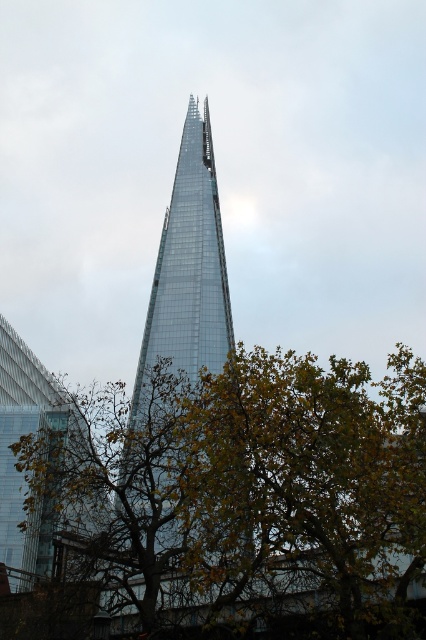
You are standing in a park and see the green leafy tree at center and the transparent glass tower at left. Which object is closer to your left side?

The transparent glass tower at left is closer to your left side because it is positioned to the left of the green leafy tree at center.

Based on the photo, you are a photographer trying to capture the transparent glass tower at left and the green leafy tree at center in a single frame. Given that the tree is blocking part of the tower, will you need to move closer to the tower to ensure both are fully visible?

The green leafy tree at center is larger in size than the transparent glass tower at left, so moving closer to the tower might help reduce the tree obstruction and allow both to be fully visible in the frame.

You are standing at the base of The Shard and looking up. You see two points marked on the glass facade of the building. The first point is at coordinates point [386,509] and the second is at point [16,388]. Which point do you see closer to your eyes?

Point [386,509] is in front of point [16,388], so you will see the point [386,509] closer to your eyes.